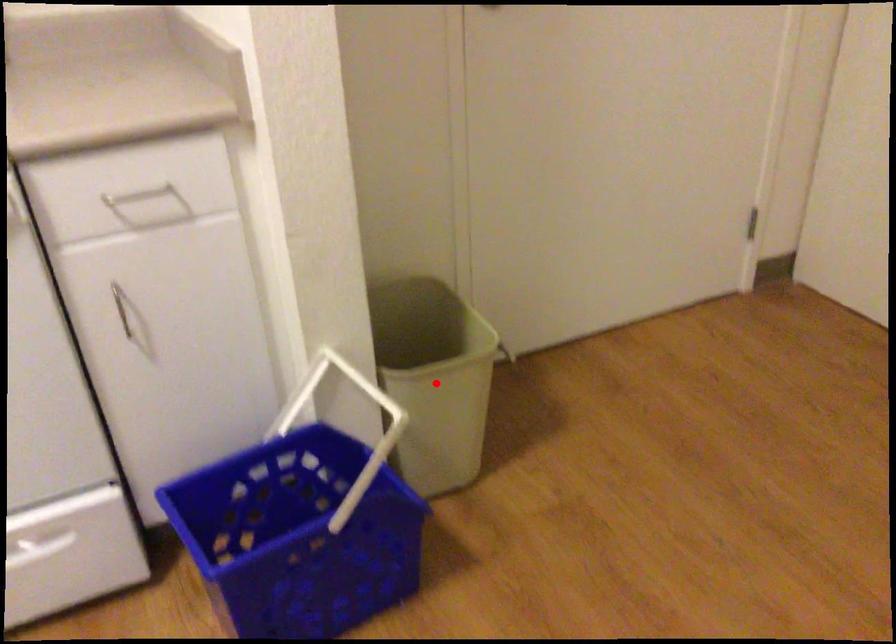
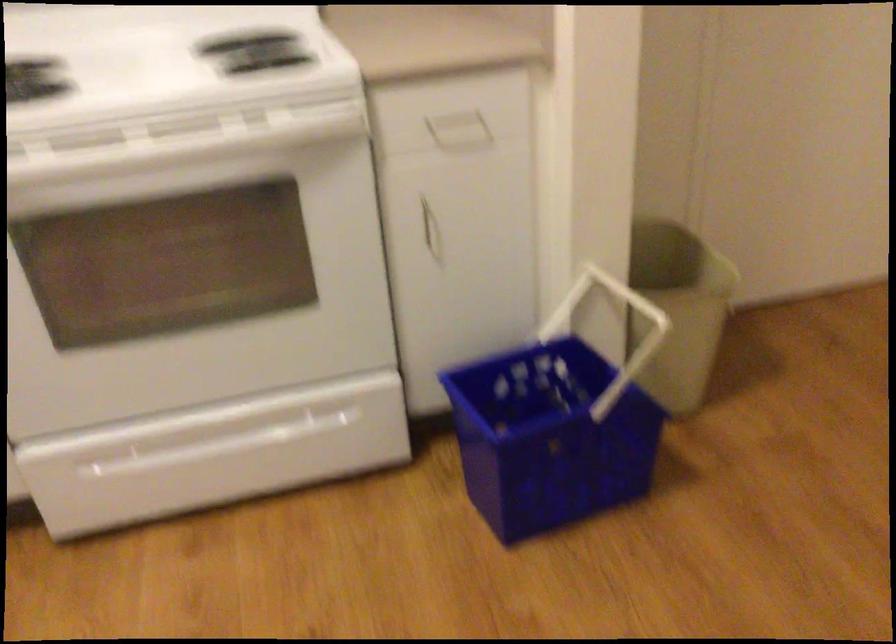
Where in the second image is the point corresponding to the highlighted location from the first image?

(678, 308)